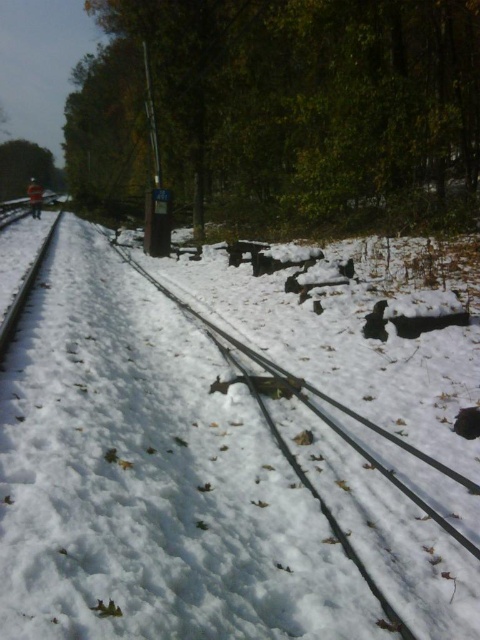
In the scene shown: Can you confirm if green leafy tree at upper center is positioned to the right of green matte tree at upper left?

Correct, you'll find green leafy tree at upper center to the right of green matte tree at upper left.

Is green leafy tree at upper center smaller than green matte tree at upper left?

No, green leafy tree at upper center is not smaller than green matte tree at upper left.

Who is more forward, [264,77] or [2,195]?

Positioned in front is point [264,77].

Locate an element on the screen. Image resolution: width=480 pixels, height=640 pixels. green leafy tree at upper center is located at coordinates (280, 106).

Is point (61, 346) positioned after point (21, 148)?

No, (61, 346) is in front of (21, 148).

Can you confirm if white matte snow at center is thinner than green matte tree at upper left?

Yes, white matte snow at center is thinner than green matte tree at upper left.

This screenshot has height=640, width=480. In order to click on white matte snow at center in this screenshot , I will do `click(151, 477)`.

Who is positioned more to the right, green leafy tree at upper center or smooth metal train track at left?

green leafy tree at upper center is more to the right.

Is point (389, 196) positioned before point (48, 244)?

No.

Is point (147, 148) farther from camera compared to point (33, 266)?

Yes.

The image size is (480, 640). What are the coordinates of `green leafy tree at upper center` in the screenshot? It's located at (280, 106).